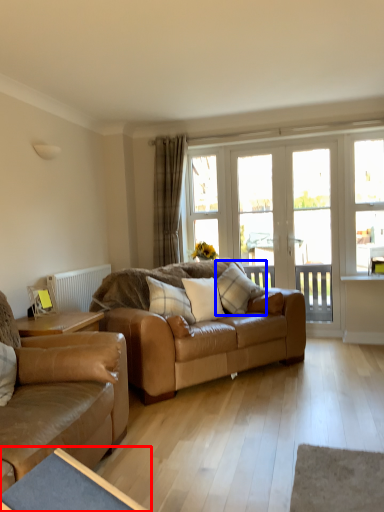
Question: Which object appears closest to the camera in this image, table (highlighted by a red box) or pillow (highlighted by a blue box)?

Choices:
 (A) table
 (B) pillow

Answer: (A)